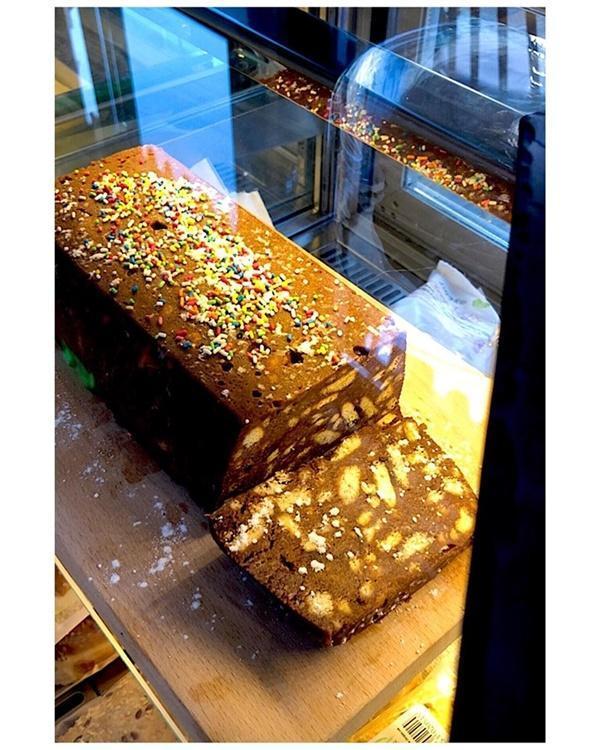
I want to click on shelf, so click(318, 706).